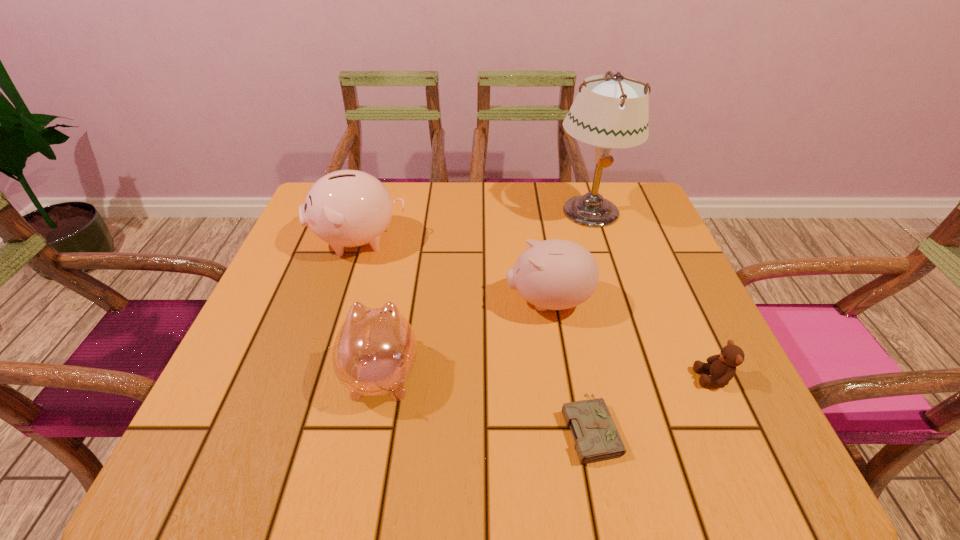
Image resolution: width=960 pixels, height=540 pixels. I want to click on free point between the lampshade and the nearest piggy bank, so click(x=486, y=292).

Locate an element on the screen. Image resolution: width=960 pixels, height=540 pixels. empty space that is in between the nearest piggy bank and the teddy bear is located at coordinates (547, 375).

Locate an element on the screen. This screenshot has width=960, height=540. empty space between the teddy bear and the lampshade is located at coordinates (651, 294).

Locate which object is the closest to the farthest piggy bank. Please provide its 2D coordinates. Your answer should be formatted as a tuple, i.e. [(x, y)], where the tuple contains the x and y coordinates of a point satisfying the conditions above.

[(374, 352)]

Select which object is the third closest to the diary. Please provide its 2D coordinates. Your answer should be formatted as a tuple, i.e. [(x, y)], where the tuple contains the x and y coordinates of a point satisfying the conditions above.

[(374, 352)]

Select which piggy bank appears as the second closest to the tallest piggy bank. Please provide its 2D coordinates. Your answer should be formatted as a tuple, i.e. [(x, y)], where the tuple contains the x and y coordinates of a point satisfying the conditions above.

[(555, 274)]

Where is `the second closest piggy bank to the tallest object`? the second closest piggy bank to the tallest object is located at coordinates (347, 208).

I want to click on free space that satisfies the following two spatial constraints: 1. on the front side of the diary; 2. on the left side of the farthest piggy bank, so click(x=300, y=427).

The image size is (960, 540). Find the location of `free space in the image that satisfies the following two spatial constraints: 1. on the front side of the diary; 2. on the left side of the fifth shortest object`. free space in the image that satisfies the following two spatial constraints: 1. on the front side of the diary; 2. on the left side of the fifth shortest object is located at coordinates (300, 427).

Find the location of a particular element. Image resolution: width=960 pixels, height=540 pixels. free location that satisfies the following two spatial constraints: 1. on the lampshade of the lampshade; 2. at the snout of the second nearest piggy bank is located at coordinates (617, 301).